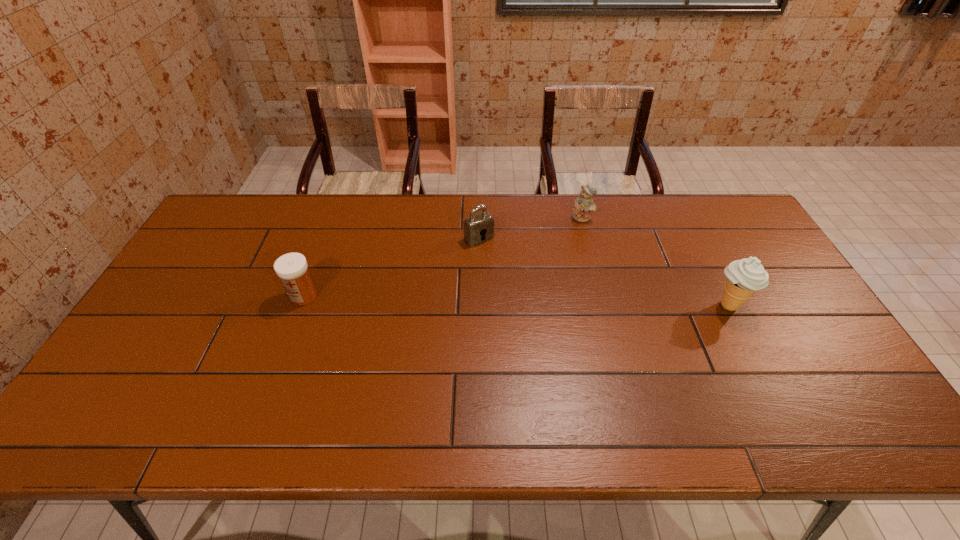
Where is `vacant space on the desktop that is between the leftmost object and the tallest object and is positioned at the front of the second object from left to right near the keyhole`? vacant space on the desktop that is between the leftmost object and the tallest object and is positioned at the front of the second object from left to right near the keyhole is located at coordinates (533, 301).

Identify the location of vacant space on the desktop that is between the leftmost object and the icecream and is positioned on the front-facing side of the farthest object. (557, 301).